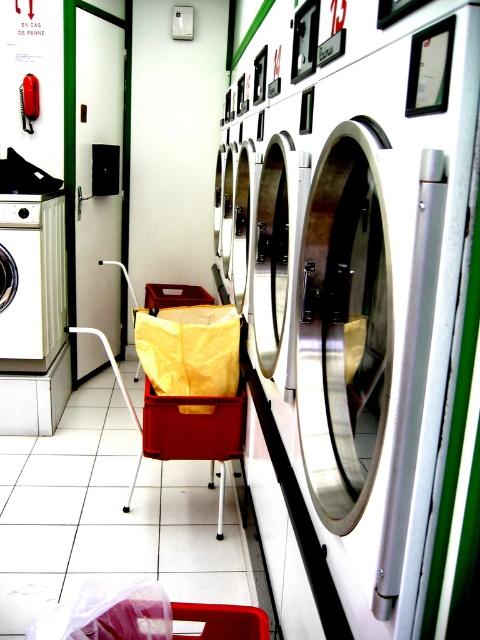
Which is more to the left, matte red cart at center or matte red plastic crate at center?

Positioned to the left is matte red cart at center.

Is point (148, 310) more distant than point (208, 408)?

Yes, it is.

Image resolution: width=480 pixels, height=640 pixels. Find the location of `matte red cart at center`. matte red cart at center is located at coordinates (188, 387).

At what (x,y) coordinates should I click in order to perform the action: click on matte red cart at center. Please return your answer as a coordinate pair (x, y). Image resolution: width=480 pixels, height=640 pixels. Looking at the image, I should click on (188, 387).

Can you confirm if white glossy washing machine at center is bigger than matte red cart at center?

Actually, white glossy washing machine at center might be smaller than matte red cart at center.

Is white glossy washing machine at center in front of matte red cart at center?

Yes.

What do you see at coordinates (386, 289) in the screenshot? I see `white glossy washing machine at center` at bounding box center [386, 289].

Identify the location of white glossy washing machine at center. The width and height of the screenshot is (480, 640). (386, 289).

Which is more to the left, white glossy washing machine at center or matte red plastic crate at center?

Positioned to the left is matte red plastic crate at center.

Who is positioned more to the right, white glossy washing machine at center or matte red plastic crate at center?

From the viewer's perspective, white glossy washing machine at center appears more on the right side.

Who is more distant from viewer, (465, 307) or (172, 422)?

Point (172, 422)

Find the location of `white glossy washing machine at center`. white glossy washing machine at center is located at coordinates (386, 289).